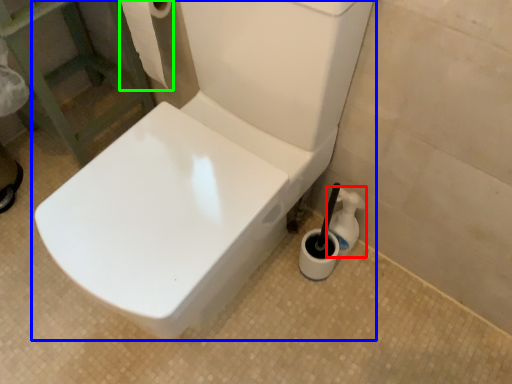
Question: Which object is positioned farthest from cleaning product (highlighted by a red box)? Select from toilet (highlighted by a blue box) and toilet paper (highlighted by a green box).

Choices:
 (A) toilet
 (B) toilet paper

Answer: (B)